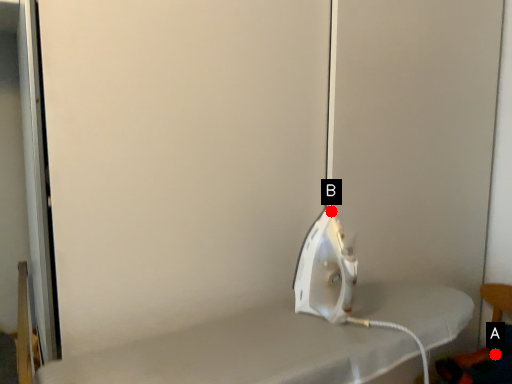
Question: Two points are circled on the image, labeled by A and B beside each circle. Which point is closer to the camera taking this photo?

Choices:
 (A) A is closer
 (B) B is closer

Answer: (B)